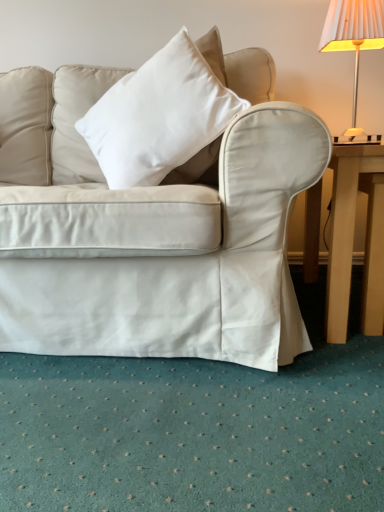
Question: Is light brown wooden table at right facing away from white pleated fabric lampshade at upper right?

Choices:
 (A) no
 (B) yes

Answer: (A)

Question: Does light brown wooden table at right contain white pleated fabric lampshade at upper right?

Choices:
 (A) no
 (B) yes

Answer: (A)

Question: From the image's perspective, is light brown wooden table at right beneath white pleated fabric lampshade at upper right?

Choices:
 (A) yes
 (B) no

Answer: (A)

Question: Can we say light brown wooden table at right lies outside white pleated fabric lampshade at upper right?

Choices:
 (A) yes
 (B) no

Answer: (A)

Question: From the image's perspective, is light brown wooden table at right over white pleated fabric lampshade at upper right?

Choices:
 (A) no
 (B) yes

Answer: (A)

Question: Can you confirm if light brown wooden table at right is taller than white pleated fabric lampshade at upper right?

Choices:
 (A) no
 (B) yes

Answer: (A)

Question: Does white cotton pillow at center lie behind light brown wooden table at right?

Choices:
 (A) yes
 (B) no

Answer: (B)

Question: From the image's perspective, is white cotton pillow at center under light brown wooden table at right?

Choices:
 (A) yes
 (B) no

Answer: (B)

Question: Is white cotton pillow at center next to light brown wooden table at right?

Choices:
 (A) no
 (B) yes

Answer: (A)

Question: Considering the relative sizes of white cotton pillow at center and light brown wooden table at right in the image provided, is white cotton pillow at center shorter than light brown wooden table at right?

Choices:
 (A) no
 (B) yes

Answer: (A)

Question: Can light brown wooden table at right be found inside white cotton pillow at center?

Choices:
 (A) no
 (B) yes

Answer: (A)

Question: Considering the relative sizes of white cotton pillow at center and light brown wooden table at right in the image provided, is white cotton pillow at center smaller than light brown wooden table at right?

Choices:
 (A) no
 (B) yes

Answer: (A)

Question: Is white pleated fabric lampshade at upper right touching white cotton pillow at center?

Choices:
 (A) no
 (B) yes

Answer: (A)